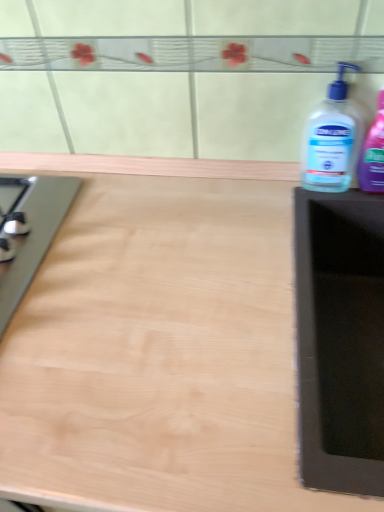
Question: Can you confirm if transparent plastic bottle at right, which is the 1th bottle from right to left, is positioned to the right of light wood countertop at center?

Choices:
 (A) no
 (B) yes

Answer: (B)

Question: Is transparent plastic bottle at right, which is the 1th bottle from right to left, taller than light wood countertop at center?

Choices:
 (A) yes
 (B) no

Answer: (B)

Question: From a real-world perspective, is transparent plastic bottle at right, arranged as the 2th bottle when viewed from the left, over light wood countertop at center?

Choices:
 (A) no
 (B) yes

Answer: (B)

Question: From the image's perspective, is transparent plastic bottle at right, which is the 1th bottle from right to left, located above light wood countertop at center?

Choices:
 (A) no
 (B) yes

Answer: (B)

Question: Is transparent plastic bottle at right, which is the 1th bottle from right to left, aimed at light wood countertop at center?

Choices:
 (A) yes
 (B) no

Answer: (B)

Question: From a real-world perspective, is transparent plastic bottle at right, which is the 1th bottle from right to left, located beneath light wood countertop at center?

Choices:
 (A) no
 (B) yes

Answer: (A)

Question: Is the position of transparent plastic bottle at right, which appears as the 2th bottle when viewed from the right, more distant than that of light wood countertop at center?

Choices:
 (A) no
 (B) yes

Answer: (B)

Question: Can you confirm if transparent plastic bottle at right, which appears as the 2th bottle when viewed from the right, is wider than light wood countertop at center?

Choices:
 (A) yes
 (B) no

Answer: (B)

Question: Can you confirm if transparent plastic bottle at right, the first bottle when ordered from left to right, is smaller than light wood countertop at center?

Choices:
 (A) no
 (B) yes

Answer: (B)

Question: Does transparent plastic bottle at right, the first bottle when ordered from left to right, touch light wood countertop at center?

Choices:
 (A) no
 (B) yes

Answer: (A)

Question: Can you confirm if transparent plastic bottle at right, the first bottle when ordered from left to right, is shorter than light wood countertop at center?

Choices:
 (A) yes
 (B) no

Answer: (A)

Question: Can you confirm if transparent plastic bottle at right, the first bottle when ordered from left to right, is positioned to the right of light wood countertop at center?

Choices:
 (A) no
 (B) yes

Answer: (B)

Question: Can you confirm if transparent plastic bottle at right, arranged as the 2th bottle when viewed from the left, is shorter than transparent plastic bottle at right, the first bottle when ordered from left to right?

Choices:
 (A) yes
 (B) no

Answer: (B)